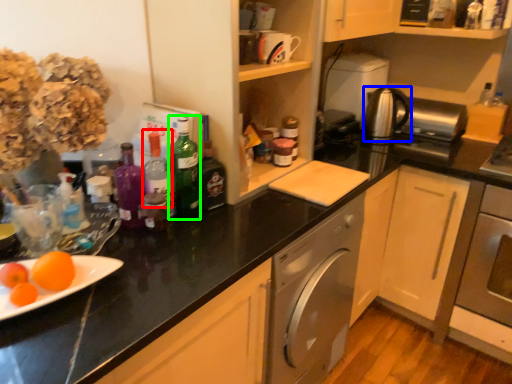
Question: Which object is the closest to the bottle (highlighted by a red box)? Choose among these: kitchen appliance (highlighted by a blue box) or bottle (highlighted by a green box).

Choices:
 (A) kitchen appliance
 (B) bottle

Answer: (B)